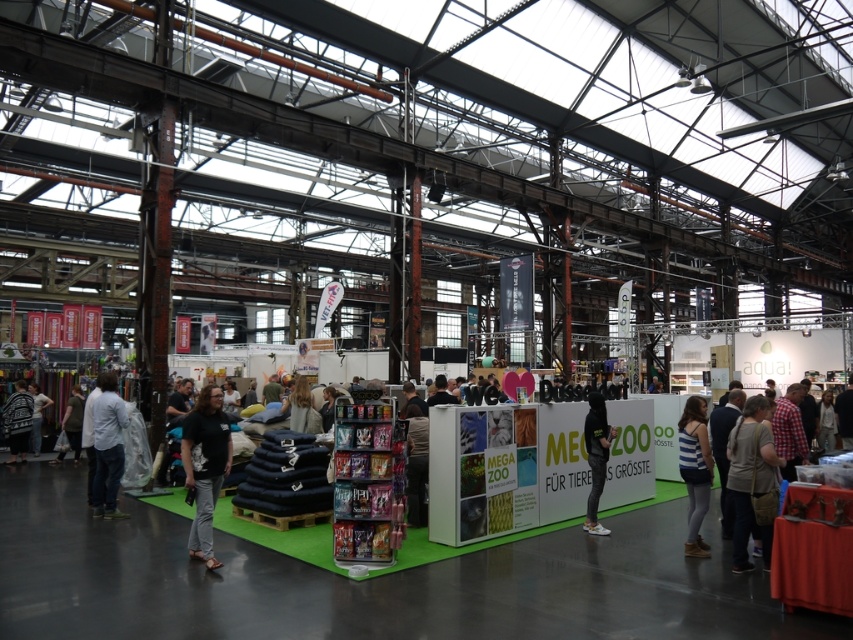
You are a fashion designer attending the MEGA ZOO exhibition and see the black matte jacket at center and the dark gray sweater at left. Which clothing item is smaller in size?

The black matte jacket at center has a smaller size compared to the dark gray sweater at left.

You are an event organizer at the MEGA ZOO booth. You need to place a new promotional banner that requires 1.5 square meters of space. The banner must be placed near both the light gray cotton shirt at center and the dark gray jeans at center. Can both items accommodate the banner between them?

The light gray cotton shirt at center occupies less space than dark gray jeans at center. Since the banner requires 1.5 square meters, and the jeans take up more space, there might be enough room between them. However, without exact measurements, it is uncertain. Consider checking the actual space available.